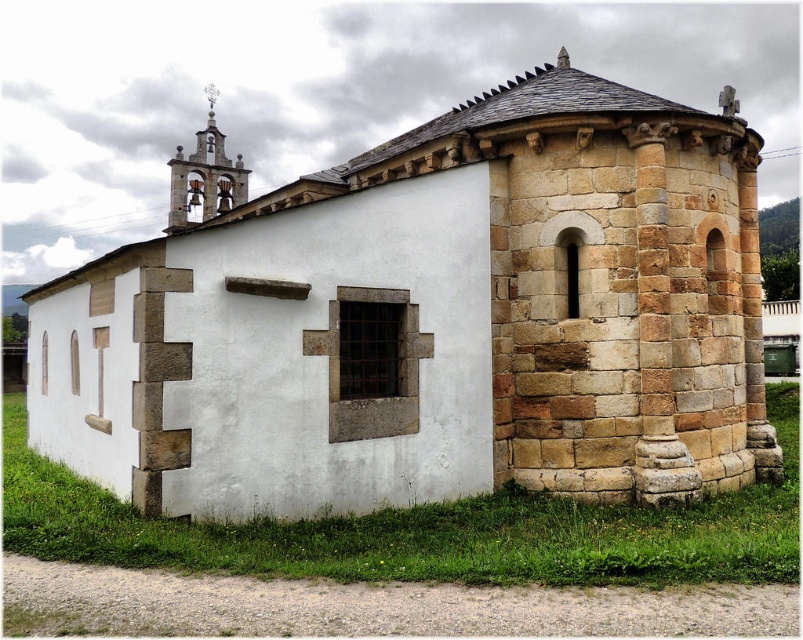
You are standing in front of the stone church at center and want to see the top of the stone bell tower at upper left. Given that both are made of stone, which one do you need to look up more to see the top of?

You need to look up more to see the top of the stone bell tower at upper left because it is taller than the stone church at center.

You are standing in front of the stone church at center. There is a point at coordinates (433,321). Where exactly is this point located on the stone church at center?

The point at (433,321) is located on the stone church at center.

You are standing at the coordinates 0.500, 0.500 in the image. Which direction should you move to reach the stone church at center?

The stone church at center is located at coordinates (433, 321), so you should move slightly northeast to reach it from your current position at (401, 320).